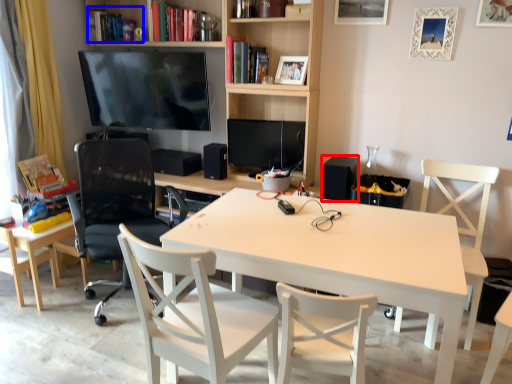
Question: Among these objects, which one is nearest to the camera, speaker (highlighted by a red box) or book (highlighted by a blue box)?

Choices:
 (A) speaker
 (B) book

Answer: (A)